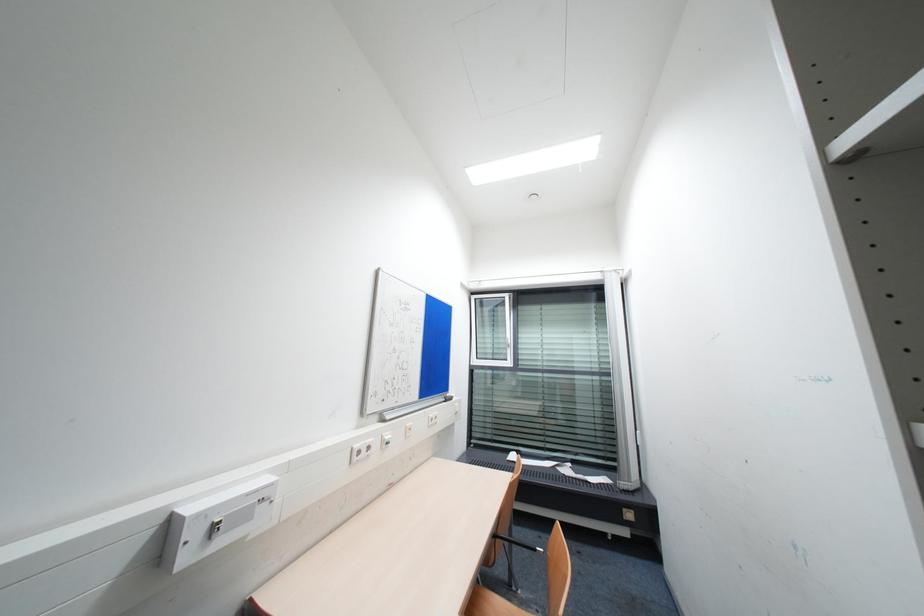
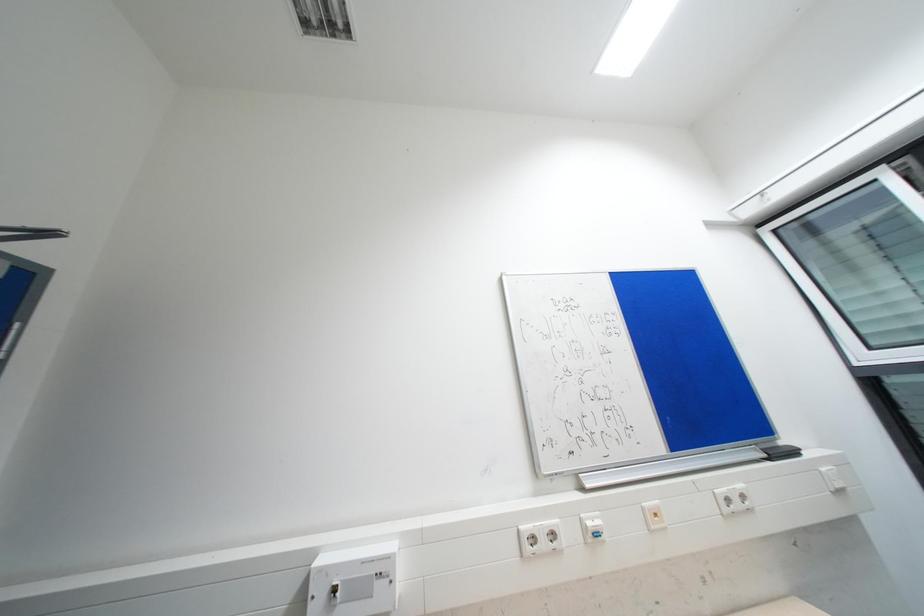
The first image is from the beginning of the video and the second image is from the end. How did the camera likely rotate when shooting the video?

The camera's rotation is toward left-up.